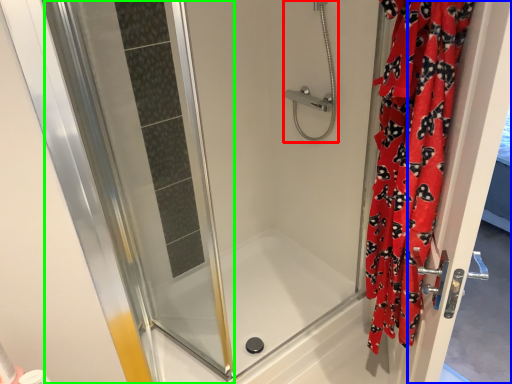
Question: Which is nearer to the shower (highlighted by a red box)? screen door (highlighted by a blue box) or screen door (highlighted by a green box).

Choices:
 (A) screen door
 (B) screen door

Answer: (B)